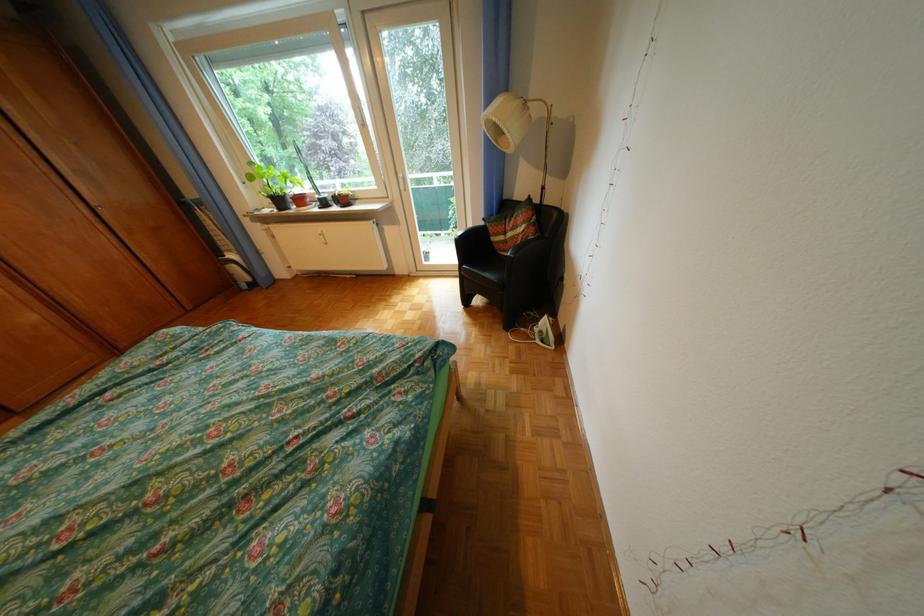
Locate an element on the screen. cream lamp shade is located at coordinates (506, 121).